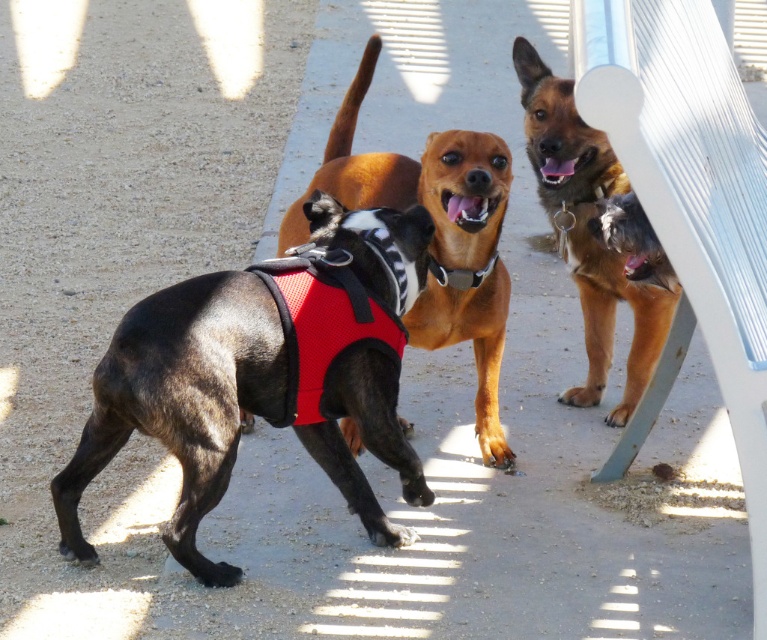
Can you confirm if black mesh vest at center is positioned below black fabric neckband at center?

Yes, black mesh vest at center is below black fabric neckband at center.

Between point (291, 307) and point (456, 276), which one is positioned behind?

Point (456, 276)

In order to click on black mesh vest at center in this screenshot , I will do `click(265, 372)`.

Image resolution: width=767 pixels, height=640 pixels. I want to click on black mesh vest at center, so click(265, 372).

Consider the image. Does black and white harness at center have a larger size compared to brown fur dog at upper right?

No, black and white harness at center is not bigger than brown fur dog at upper right.

Consider the image. Is black and white harness at center taller than brown fur dog at upper right?

No.

Where is `black and white harness at center`? black and white harness at center is located at coordinates (413, 180).

Consider the image. Does black and white harness at center have a smaller size compared to black fabric neckband at center?

No.

This screenshot has width=767, height=640. What do you see at coordinates (413, 180) in the screenshot?
I see `black and white harness at center` at bounding box center [413, 180].

The image size is (767, 640). What do you see at coordinates (413, 180) in the screenshot?
I see `black and white harness at center` at bounding box center [413, 180].

At what (x,y) coordinates should I click in order to perform the action: click on black and white harness at center. Please return your answer as a coordinate pair (x, y). Looking at the image, I should click on (413, 180).